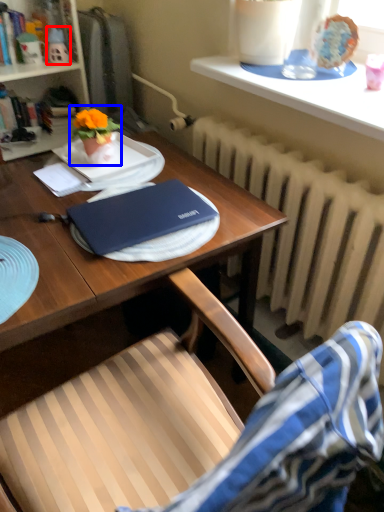
Question: Which of the following is the closest to the observer, toy (highlighted by a red box) or houseplant (highlighted by a blue box)?

Choices:
 (A) toy
 (B) houseplant

Answer: (B)